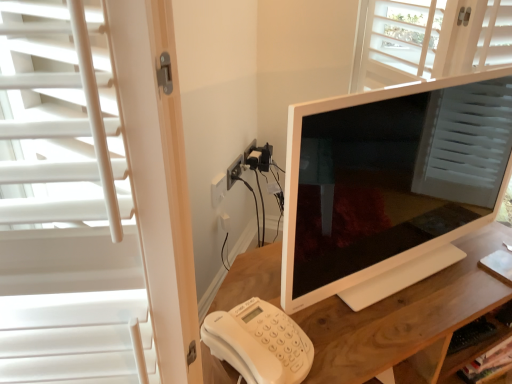
Where is `empty space that is ontop of wooden desk at center (from a real-world perspective)`? This screenshot has height=384, width=512. empty space that is ontop of wooden desk at center (from a real-world perspective) is located at coordinates (386, 283).